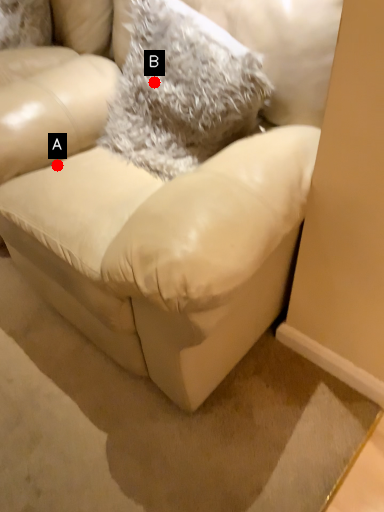
Question: Two points are circled on the image, labeled by A and B beside each circle. Which point is farther from the camera taking this photo?

Choices:
 (A) A is further
 (B) B is further

Answer: (A)